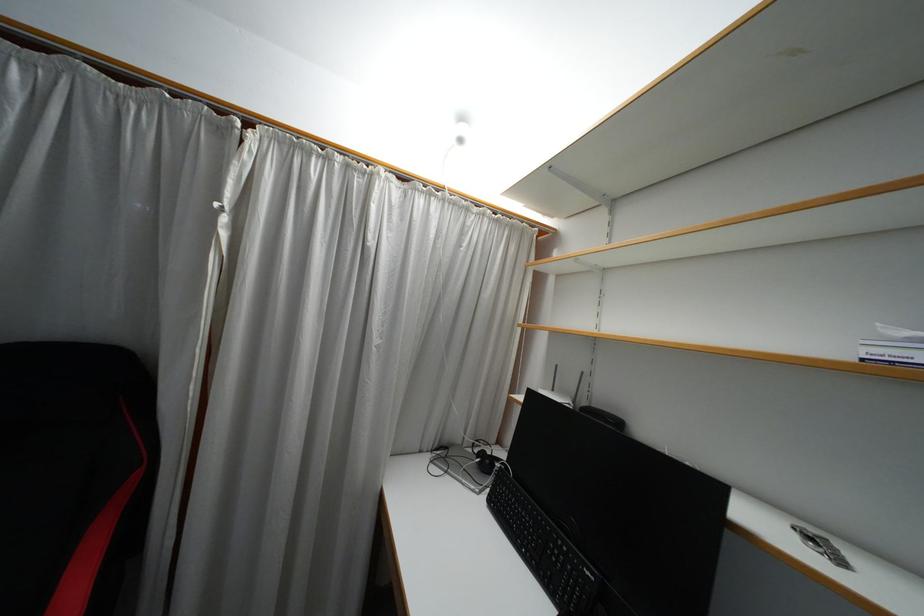
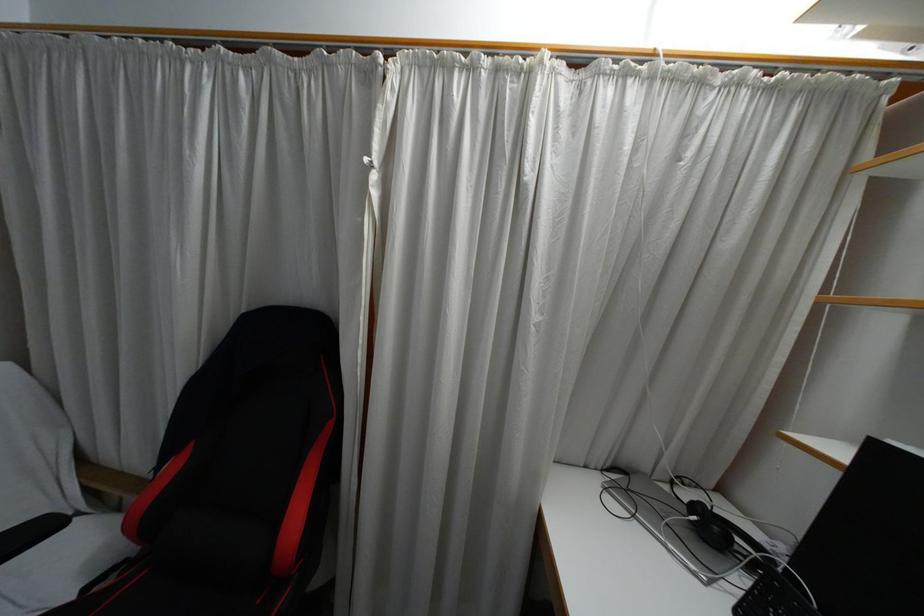
Question: The images are taken continuously from a first-person perspective. In which direction is your viewpoint rotating?

Choices:
 (A) Left
 (B) Right
 (C) Up
 (D) Down

Answer: (A)